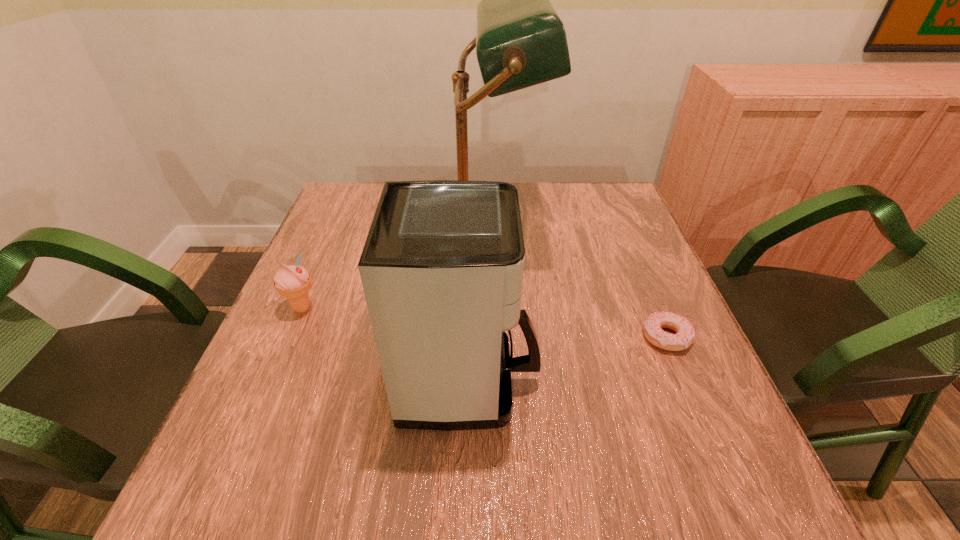
Find the location of a particular element. This screenshot has width=960, height=540. free spot between the rightmost object and the farthest object is located at coordinates (573, 285).

Locate an element on the screen. The width and height of the screenshot is (960, 540). vacant space that's between the tallest object and the doughnut is located at coordinates (573, 285).

This screenshot has width=960, height=540. Identify the location of vacant space that is in between the third shortest object and the rightmost object. (568, 359).

At what (x,y) coordinates should I click in order to perform the action: click on vacant space that is in between the tallest object and the rightmost object. Please return your answer as a coordinate pair (x, y). The height and width of the screenshot is (540, 960). Looking at the image, I should click on (573, 285).

Identify the location of free point between the doughnut and the tallest object. This screenshot has height=540, width=960. (573, 285).

Identify the location of the third closest object to the leftmost object. The height and width of the screenshot is (540, 960). (653, 325).

Identify which object is located as the second nearest to the third shortest object. Please provide its 2D coordinates. Your answer should be formatted as a tuple, i.e. [(x, y)], where the tuple contains the x and y coordinates of a point satisfying the conditions above.

[(292, 282)]

Image resolution: width=960 pixels, height=540 pixels. What are the coordinates of `vacant space that satisfies the following two spatial constraints: 1. above the green lampshade of the tallest object; 2. on the left side of the doughnut` in the screenshot? It's located at (479, 337).

At what (x,y) coordinates should I click in order to perform the action: click on free space that satisfies the following two spatial constraints: 1. on the front side of the third tallest object; 2. on the left side of the shortest object. Please return your answer as a coordinate pair (x, y). Looking at the image, I should click on (290, 337).